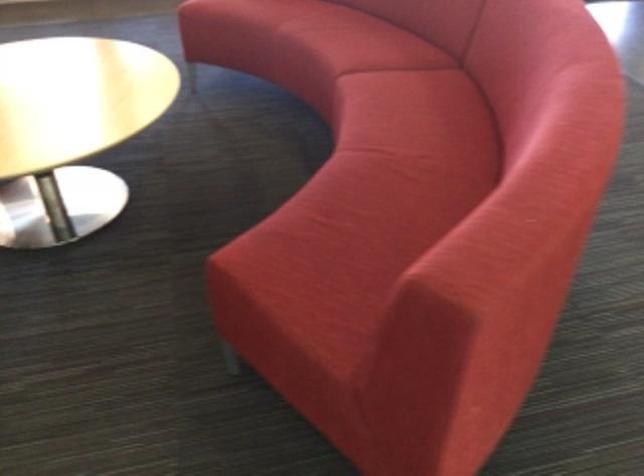
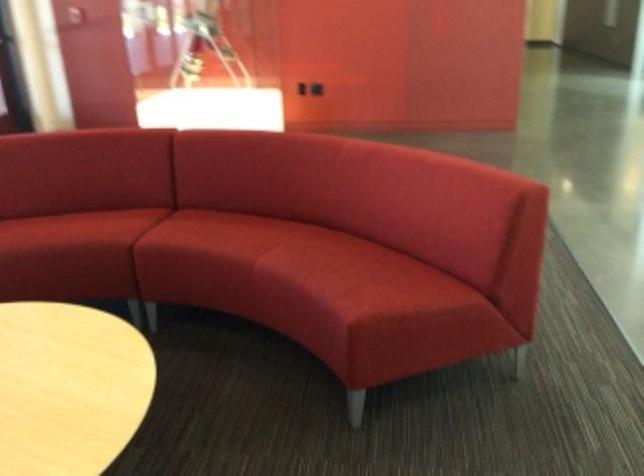
Find the pixel in the second image that matches point 366,194 in the first image.

(328, 258)